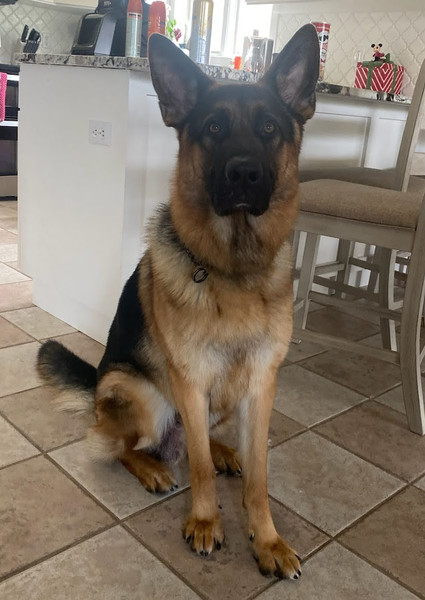
Where is `sockets`? sockets is located at coordinates (100, 130).